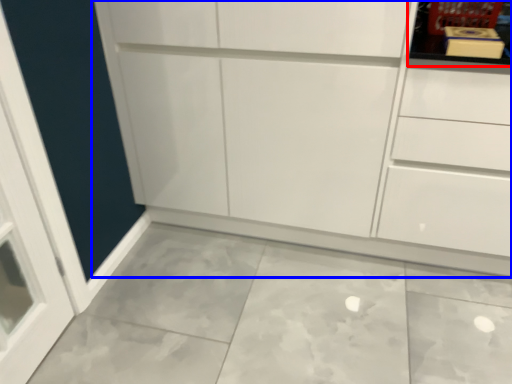
Question: Which of the following is the closest to the observer, shelf (highlighted by a red box) or cupboard (highlighted by a blue box)?

Choices:
 (A) shelf
 (B) cupboard

Answer: (B)